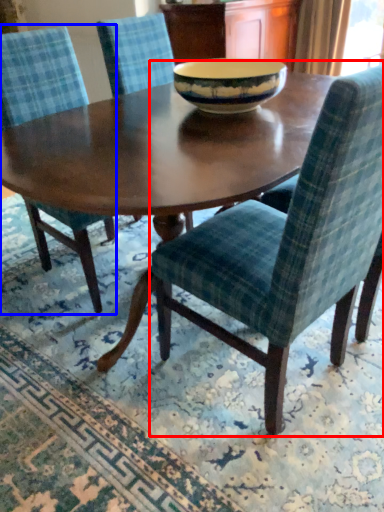
Question: Which of the following is the farthest to the observer, chair (highlighted by a red box) or chair (highlighted by a blue box)?

Choices:
 (A) chair
 (B) chair

Answer: (B)